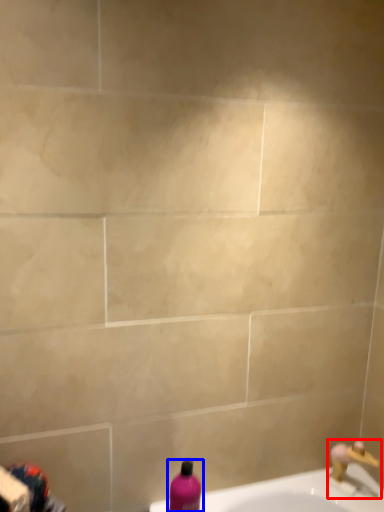
Question: Which of the following is the closest to the observer, tap (highlighted by a red box) or bottle (highlighted by a blue box)?

Choices:
 (A) tap
 (B) bottle

Answer: (B)